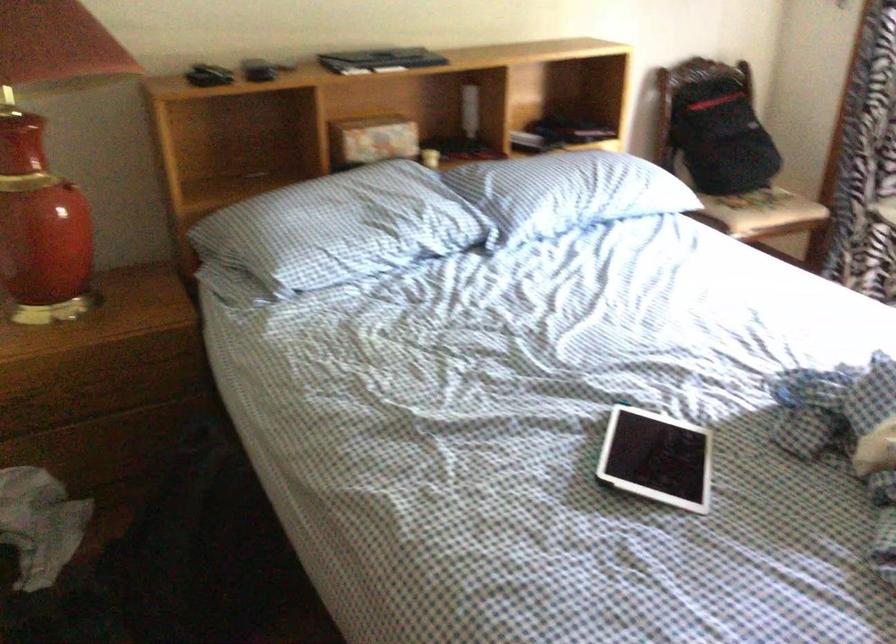
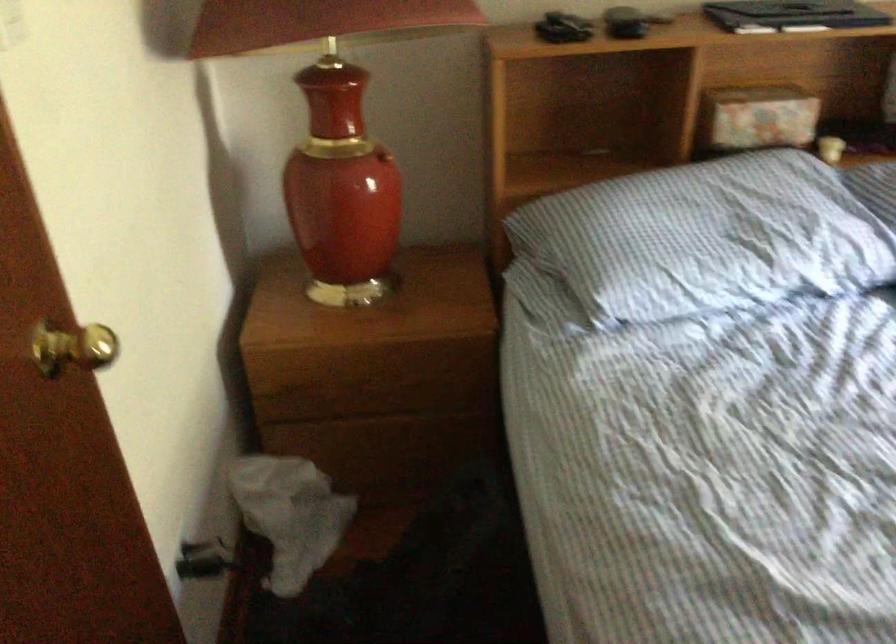
Question: How did the camera likely rotate?

Choices:
 (A) Left
 (B) Right
 (C) Up
 (D) Down

Answer: (A)